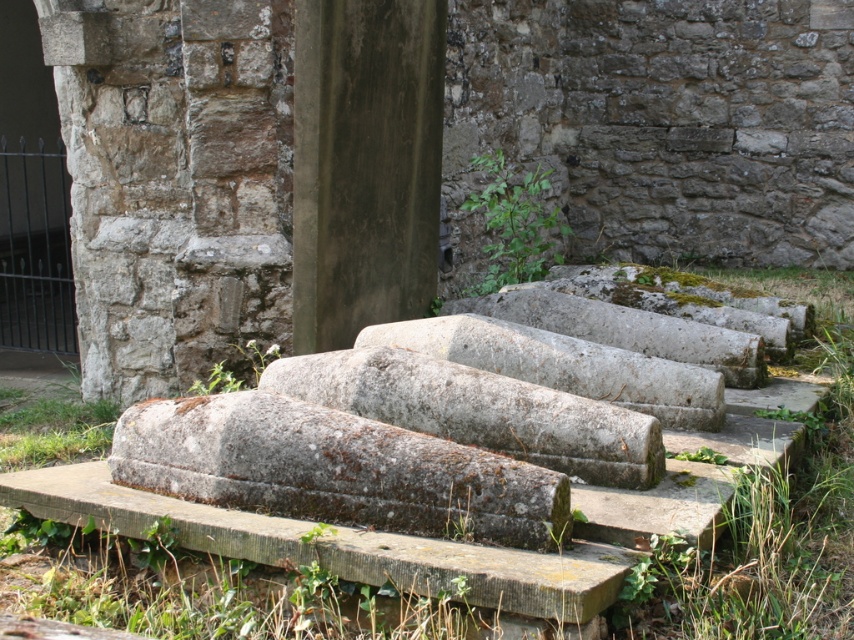
Question: From the image, what is the correct spatial relationship of smooth concrete pillar at center in relation to green leafy plant at center?

Choices:
 (A) below
 (B) above

Answer: (A)

Question: Where is gray stone sarcophagi at center located in relation to green leafy plant at center in the image?

Choices:
 (A) left
 (B) right

Answer: (A)

Question: Is green mossy grass at center further to the viewer compared to smooth concrete pillar at center?

Choices:
 (A) yes
 (B) no

Answer: (B)

Question: Which object is positioned closest to the gray stone sarcophagi at center?

Choices:
 (A) green leafy plant at center
 (B) smooth concrete pillar at center

Answer: (B)

Question: Which point is closer to the camera taking this photo?

Choices:
 (A) (x=194, y=608)
 (B) (x=548, y=225)
 (C) (x=544, y=24)
 (D) (x=395, y=88)

Answer: (A)

Question: Which of the following is the farthest from the observer?

Choices:
 (A) green leafy plant at center
 (B) gray stone sarcophagi at center

Answer: (A)